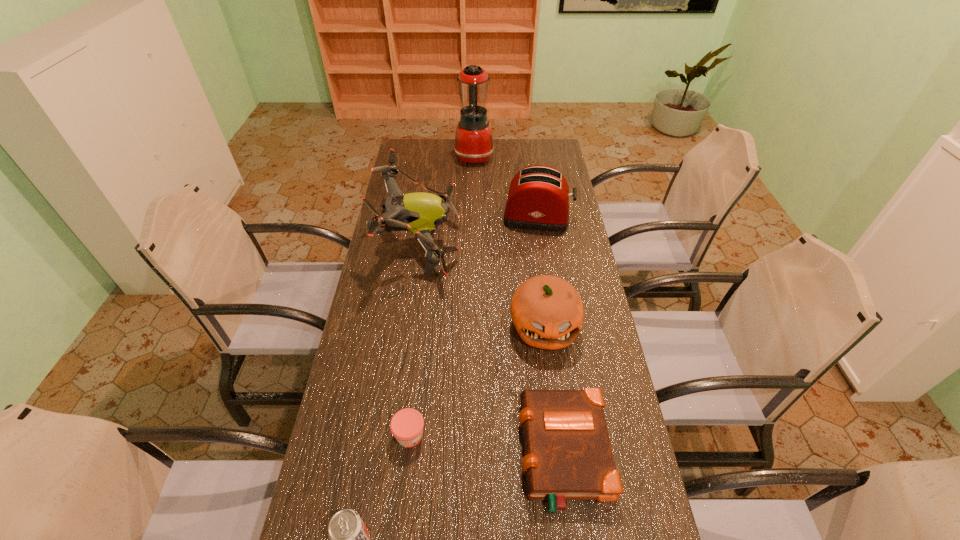
You are a GUI agent. You are given a task and a screenshot of the screen. Output one action in this format:
    pyautogui.click(x=<x>, y=<y>)
    Task: Click on the free space located 0.060m on the face of the fourth nearest object
    This screenshot has width=960, height=540.
    Given the screenshot: What is the action you would take?
    pyautogui.click(x=550, y=373)

The height and width of the screenshot is (540, 960). Identify the location of free space located on the spine side of the Bible. (496, 454).

At what (x,y) coordinates should I click in order to perform the action: click on vacant space located 0.230m on the spine side of the Bible. Please return your answer as a coordinate pair (x, y). Looking at the image, I should click on (429, 454).

This screenshot has height=540, width=960. Find the location of `vacant space located on the spine side of the Bible`. vacant space located on the spine side of the Bible is located at coordinates (496, 454).

Locate an element on the screen. The height and width of the screenshot is (540, 960). free space located on the front label of the jam is located at coordinates (465, 435).

Image resolution: width=960 pixels, height=540 pixels. What are the coordinates of `object situated at the far edge` in the screenshot? It's located at (474, 143).

Find the location of a particular element. The height and width of the screenshot is (540, 960). drone situated at the left edge is located at coordinates (419, 212).

You are a GUI agent. You are given a task and a screenshot of the screen. Output one action in this format:
    pyautogui.click(x=<x>, y=<y>)
    Task: Click on the jam that is at the left edge
    
    Given the screenshot: What is the action you would take?
    pyautogui.click(x=406, y=425)

Where is `toaster that is positioned at the right edge`? toaster that is positioned at the right edge is located at coordinates (538, 199).

Find the location of `pumpkin that is positioned at the right edge`. pumpkin that is positioned at the right edge is located at coordinates (547, 311).